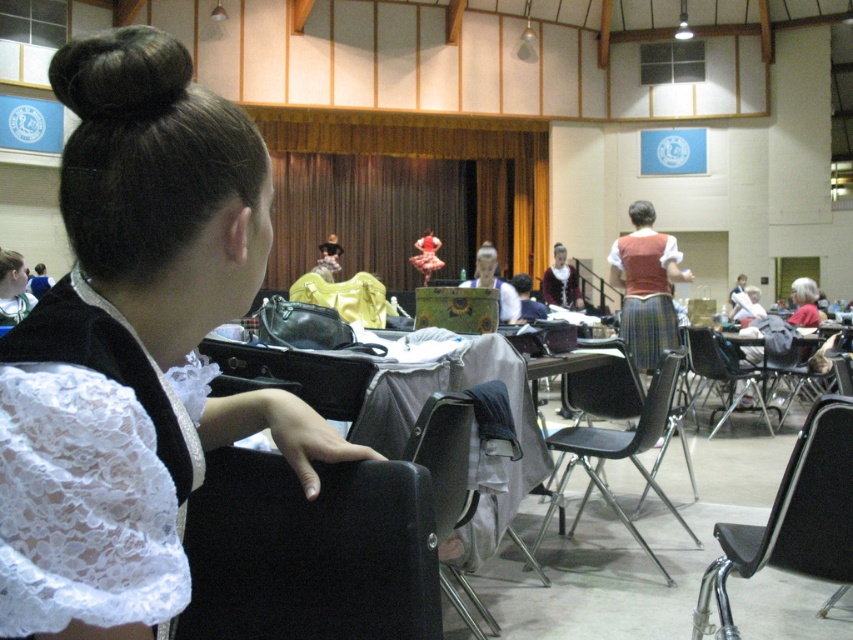
Image resolution: width=853 pixels, height=640 pixels. I want to click on white lace dress at center, so click(x=115, y=445).

Is white lace dress at center in front of black plastic chair at center?

Yes.

Does point (91, 566) come in front of point (659, 369)?

Yes, point (91, 566) is in front of point (659, 369).

I want to click on white lace dress at center, so click(x=115, y=445).

Which is more to the right, black fabric chair at lower right or metallic silver table at center?

From the viewer's perspective, metallic silver table at center appears more on the right side.

Between black fabric chair at lower right and metallic silver table at center, which one is positioned lower?

black fabric chair at lower right is below.

Which is in front, point (698, 618) or point (766, 372)?

Positioned in front is point (698, 618).

In order to click on black fabric chair at lower right in this screenshot , I will do `click(793, 516)`.

Between point (38, 362) and point (627, 240), which one is positioned in front?

Point (38, 362)

Is white lace dress at center thinner than plaid skirt at center?

Indeed, white lace dress at center has a lesser width compared to plaid skirt at center.

What do you see at coordinates (115, 445) in the screenshot? Image resolution: width=853 pixels, height=640 pixels. I see `white lace dress at center` at bounding box center [115, 445].

Locate an element on the screen. The image size is (853, 640). white lace dress at center is located at coordinates (115, 445).